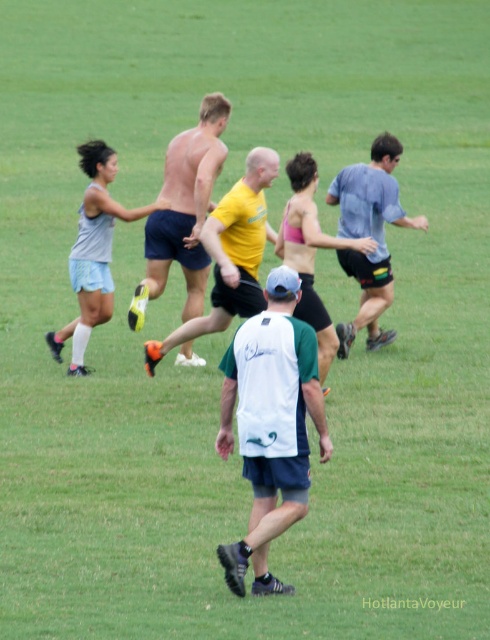
You are a photographer positioned at the edge of the field. You want to take a photo that includes both the shiny blue shorts at center and the light blue fabric shirt at right. What is the minimum distance you need to move backward to ensure both subjects are in frame?

The minimum distance you need to move backward is 2.32 meters to ensure both the shiny blue shorts at center and the light blue fabric shirt at right are in frame.

You are a referee standing at the position of the man in white and green jersey. You need to determine if the two players wearing the yellow matte shirt at center and the light blue fabric shirt at right are within the required 3 meters distance for a valid pass. Can you confirm this?

The yellow matte shirt at center and the light blue fabric shirt at right are 2.56 meters apart, which is within the required 3 meters distance for a valid pass. Therefore, the pass is valid.

Based on the photo, you are a photographer positioned at the camera. You want to capture a closeup shot of the shiny blue shorts at center. Can you do so without moving from your current position?

The shiny blue shorts at center and camera are 12.64 meters apart, so you can capture a closeup shot of the shiny blue shorts at center without moving from your current position if your camera has sufficient zoom capability.